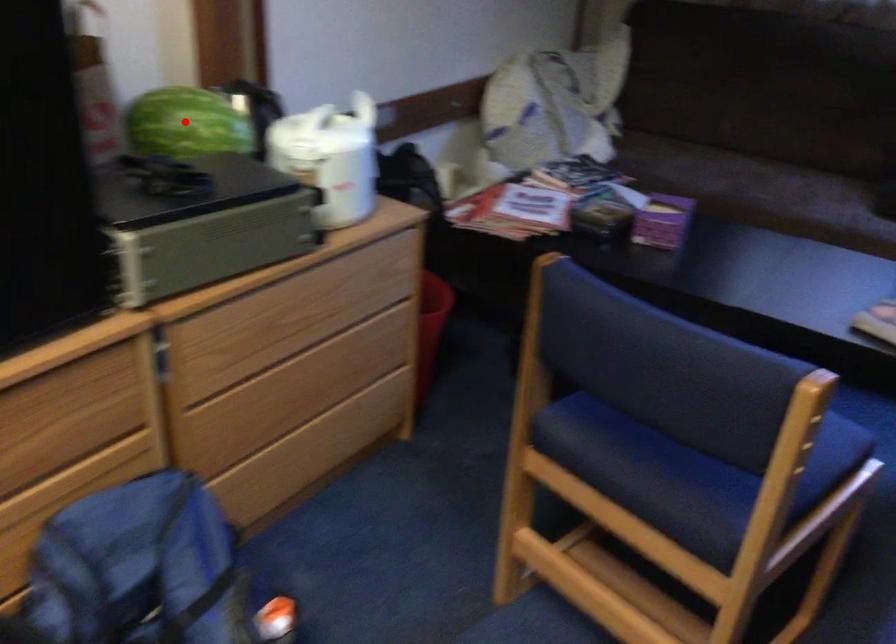
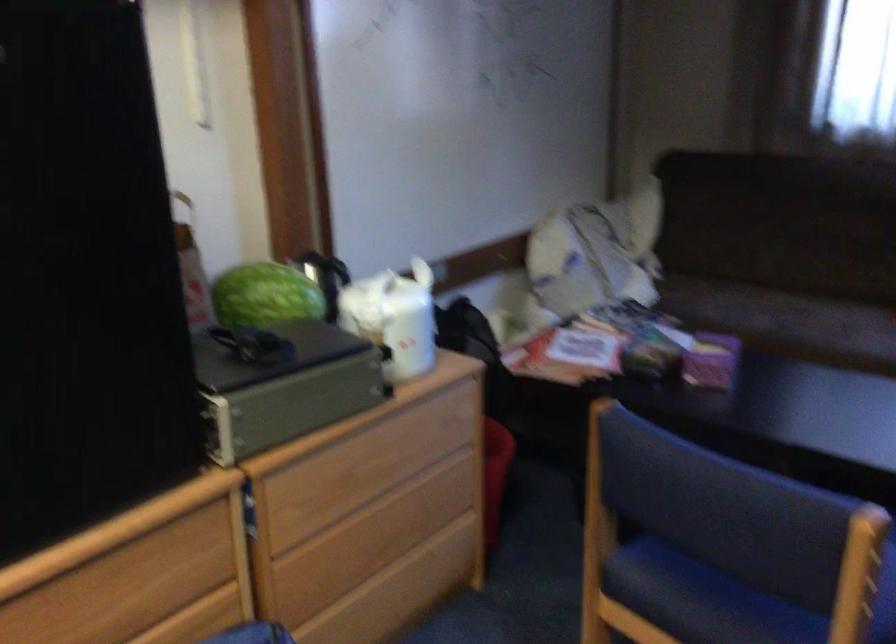
Question: I am providing you with two images of the same scene from different viewpoints. Given a red point in image1, look at the same physical point in image2. Is it:

Choices:
 (A) Closer to the viewpoint
 (B) Farther from the viewpoint

Answer: (B)